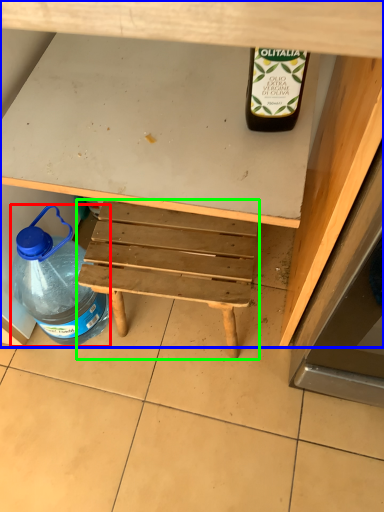
Question: Which object is the farthest from bottle (highlighted by a red box)? Choose among these: desk (highlighted by a blue box) or stool (highlighted by a green box).

Choices:
 (A) desk
 (B) stool

Answer: (A)